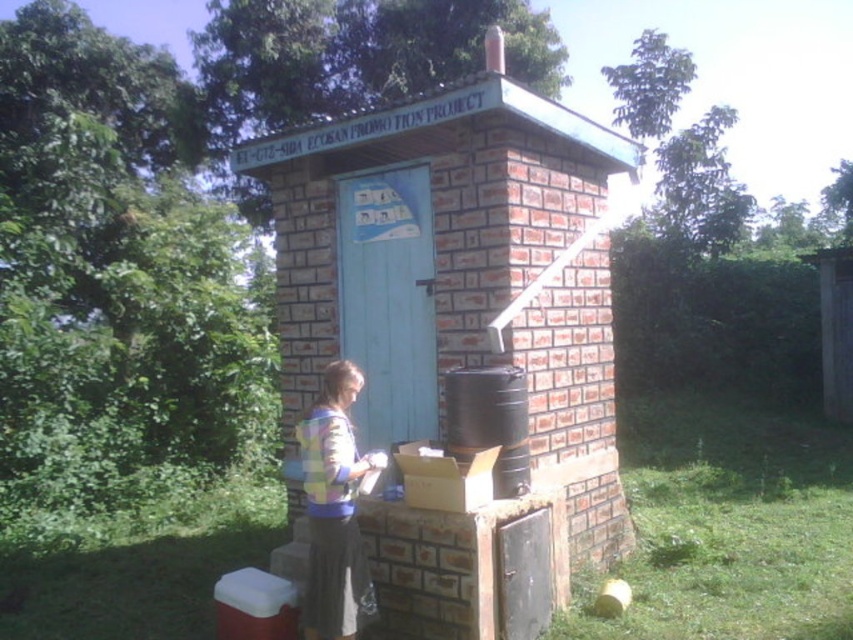
Between brick/textured hut at center and multicolored knitted sweater at center, which one has more height?

brick/textured hut at center

Looking at this image, can you confirm if brick/textured hut at center is positioned to the left of multicolored knitted sweater at center?

Incorrect, brick/textured hut at center is not on the left side of multicolored knitted sweater at center.

I want to click on brick/textured hut at center, so click(457, 275).